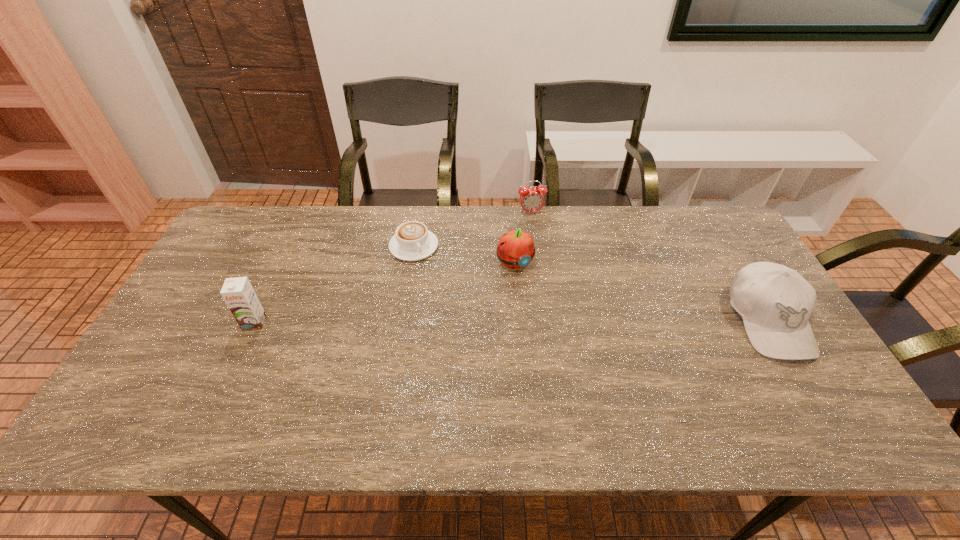
Find the location of a particular element. This screenshot has width=960, height=540. vacant spot on the desktop that is between the leftmost object and the rightmost object and is positioned on the surface of the apple is located at coordinates [x=560, y=321].

The image size is (960, 540). I want to click on free space on the desktop that is between the leftmost object and the baseball cap and is positioned with the handle on the right side of the second object from left to right, so click(x=476, y=322).

Identify the location of free space on the desktop that is between the leftmost object and the baseball cap and is positioned on the face of the farthest object. This screenshot has height=540, width=960. (559, 321).